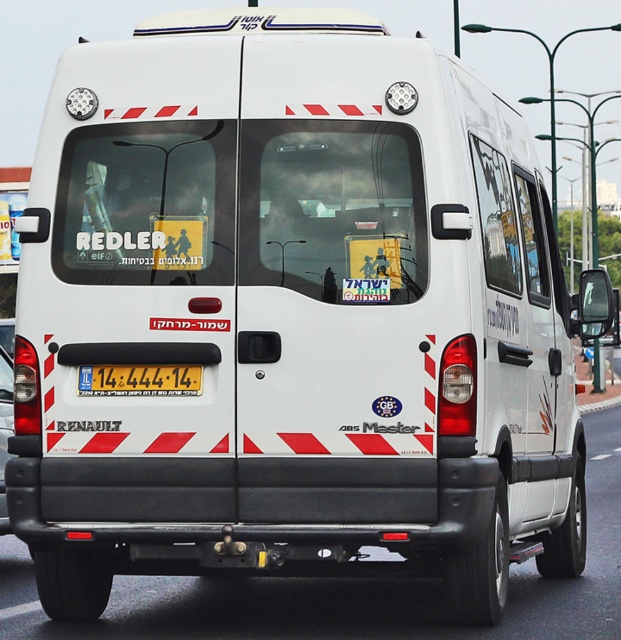
You are a delivery driver who needs to attach a new license plate to the van. The new license plate must be placed exactly 3 meters away from the existing white matte van at center. Can the current yellow plastic license plate at center be used for this requirement?

The yellow plastic license plate at center is currently 2.89 meters from the white matte van at center, which is 11 centimeters shorter than the required 3 meters. Therefore, it cannot be used as is and needs adjustment.

You are a delivery driver who needs to ensure the license plate is visible for GPS tracking. Is the yellow plastic license plate at center obstructed by the white matte van at center?

The yellow plastic license plate at center is positioned over white matte van at center, so it is not obstructed by the van.

You are a traffic officer checking license plates. You observe the yellow plastic license plate at center and the white matte van at center. Which object is smaller in size?

The yellow plastic license plate at center is smaller than the white matte van at center.